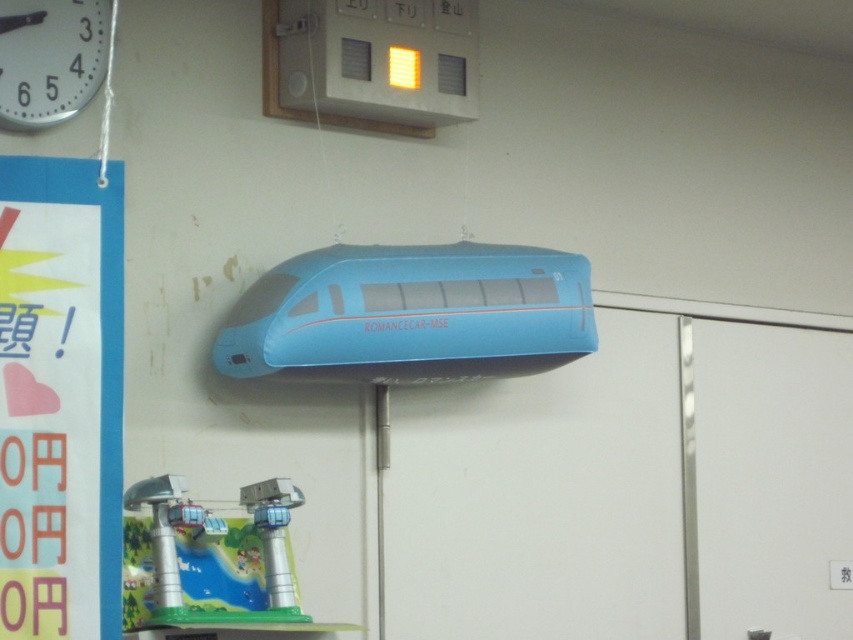
Which is more to the left, blue matte train at center or metallic clock at upper left?

From the viewer's perspective, metallic clock at upper left appears more on the left side.

How distant is blue matte train at center from metallic clock at upper left?

blue matte train at center and metallic clock at upper left are 1.06 meters apart.

At what (x,y) coordinates should I click in order to perform the action: click on blue matte train at center. Please return your answer as a coordinate pair (x, y). Looking at the image, I should click on (410, 314).

Find the location of a particular element. The width and height of the screenshot is (853, 640). blue matte train at center is located at coordinates (410, 314).

Looking at this image, is blue cardboard sign at left to the left of metallic clock at upper left from the viewer's perspective?

In fact, blue cardboard sign at left is to the right of metallic clock at upper left.

Does blue cardboard sign at left have a lesser height compared to metallic clock at upper left?

Incorrect, blue cardboard sign at left's height does not fall short of metallic clock at upper left's.

Does point (82, 582) come closer to viewer compared to point (71, 12)?

Yes, it is.

Locate an element on the screen. The width and height of the screenshot is (853, 640). blue cardboard sign at left is located at coordinates (61, 397).

Based on the photo, does blue cardboard sign at left have a lesser height compared to blue matte train at center?

No.

What do you see at coordinates (61, 397) in the screenshot?
I see `blue cardboard sign at left` at bounding box center [61, 397].

The image size is (853, 640). In order to click on blue cardboard sign at left in this screenshot , I will do `click(61, 397)`.